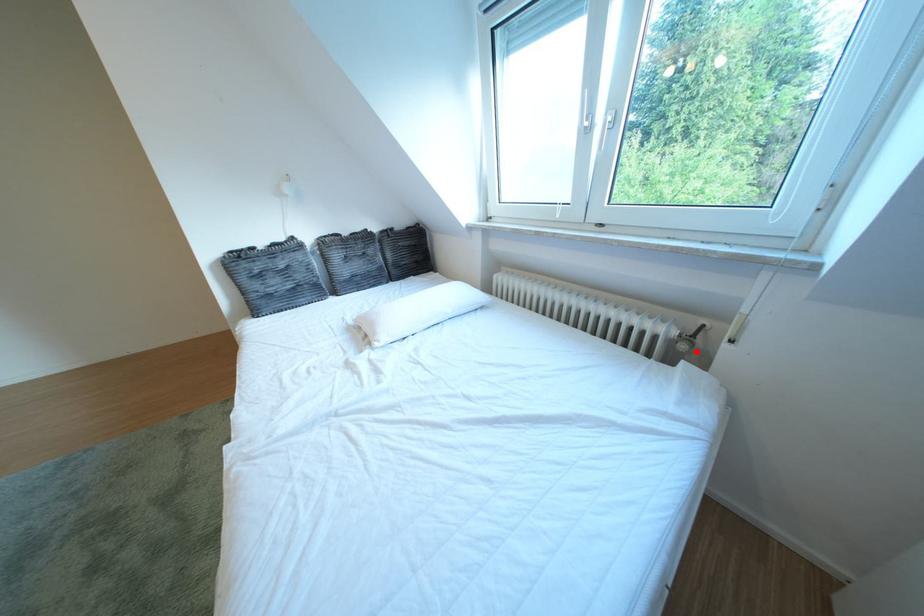
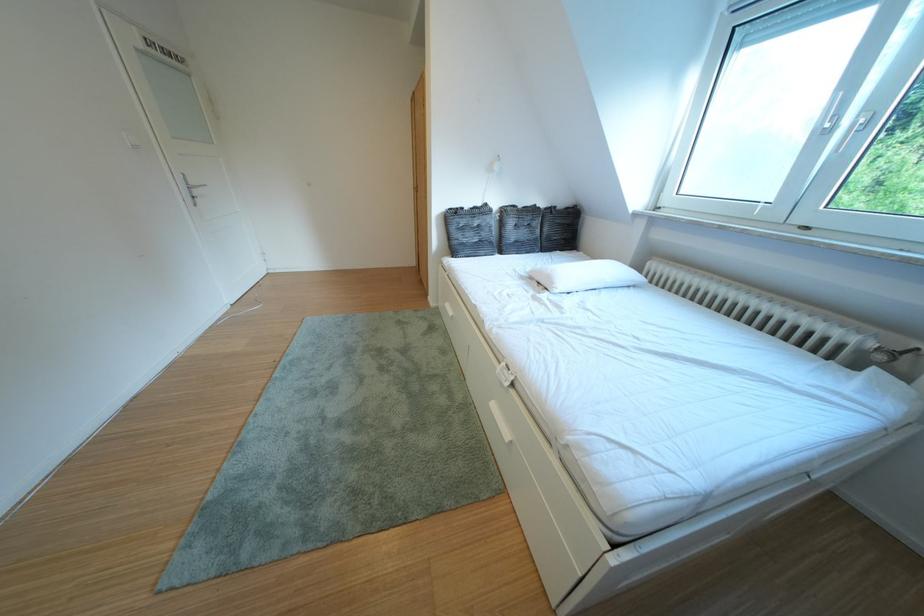
Question: I am providing you with two images of the same scene from different viewpoints. Image1 has a red point marked. In image2, the corresponding 3D location appears at what relative position? Reply with the corresponding letter.

Choices:
 (A) Closer
 (B) Farther

Answer: (B)